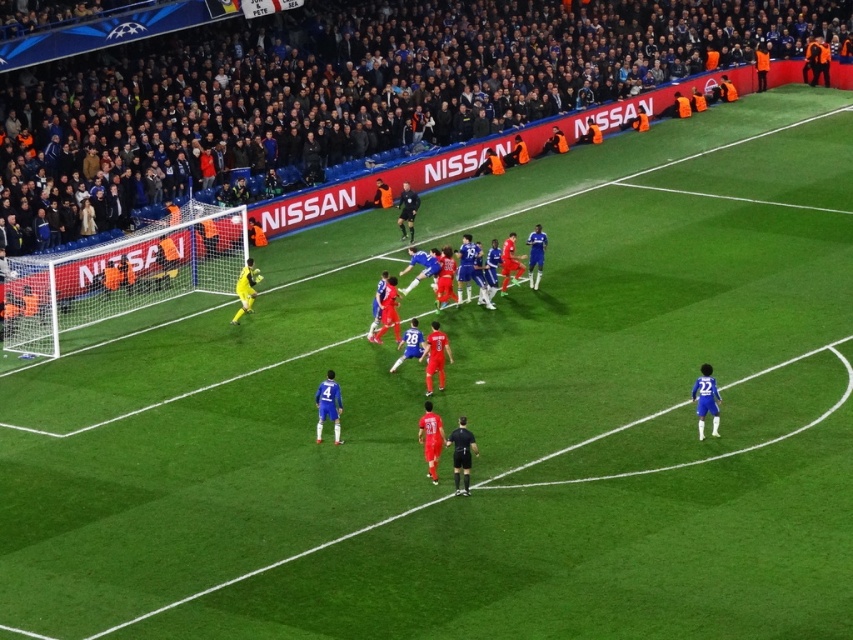
Consider the image. You are a photographer at the soccer match and want to capture the dark blue fabric crowd at upper center in your photo. What are the coordinates where you should focus your camera?

You should focus your camera at point (352, 90) to capture the dark blue fabric crowd at upper center.

You are a soccer player trying to pass the ball to your teammate. You have two options for passing the ball to either point marked as point [289,116] or point [518,266]. Based on their positions, which point is further away from the current position of the goalkeeper in yellow near the left goalpost?

Point [289,116] is behind point [518,266]. Therefore, point [289,116] is further away from the goalkeeper in yellow near the left goalpost.

You are a photographer standing at the edge of the soccer field. You want to take a photo that includes both the Nissan logo on the stands and the goalkeeper in yellow near the goalpost. Which of the two points, point 1 at coordinates point (242, 291) or point 2 at coordinates point (480, 268), should you focus on to ensure both elements are in sharp focus?

You should focus on point 1 at coordinates point (242, 291) because it is closer to the camera than point 2 at coordinates point (480, 268). Since the Nissan logo and the goalkeeper are likely at different distances, focusing on the closer point will help ensure both are in focus through the depth of field.